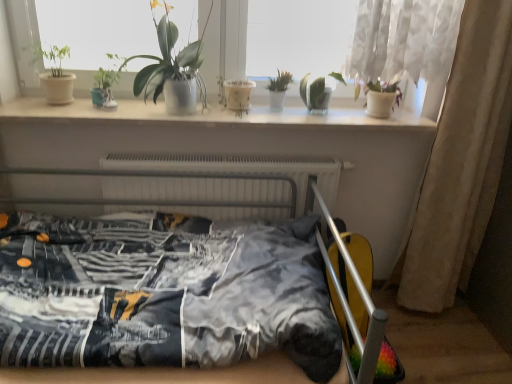
The height and width of the screenshot is (384, 512). Identify the location of free spot in front of matte white flowerpot at center. (x=230, y=115).